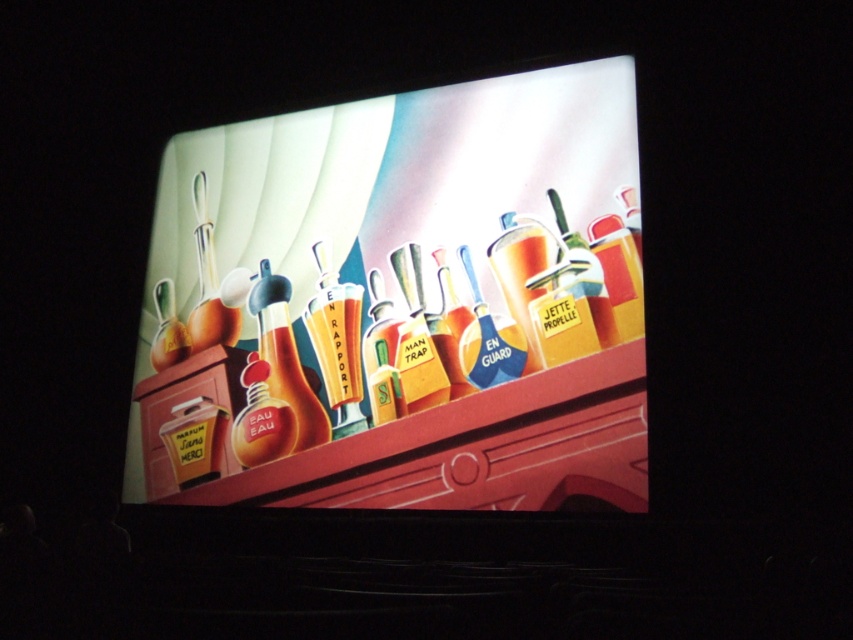
Question: Does shiny plastic bottles at center have a lesser width compared to matte glass bottle at center?

Choices:
 (A) yes
 (B) no

Answer: (B)

Question: Can you confirm if matte glass bottle at center is positioned to the right of yellow matte bottle at center?

Choices:
 (A) yes
 (B) no

Answer: (B)

Question: Is the position of matte glass bottle at center less distant than that of yellow matte bottle at center?

Choices:
 (A) no
 (B) yes

Answer: (A)

Question: Which point is farther from the camera taking this photo?

Choices:
 (A) (425, 380)
 (B) (325, 298)
 (C) (294, 177)
 (D) (177, 360)

Answer: (C)

Question: Which point is closer to the camera taking this photo?

Choices:
 (A) (479, 384)
 (B) (573, 387)
 (C) (171, 305)

Answer: (B)

Question: Estimate the real-world distances between objects in this image. Which object is farther from the matte glass spray can at center?

Choices:
 (A) matte glass bottle at center
 (B) shiny plastic bottles at center

Answer: (B)